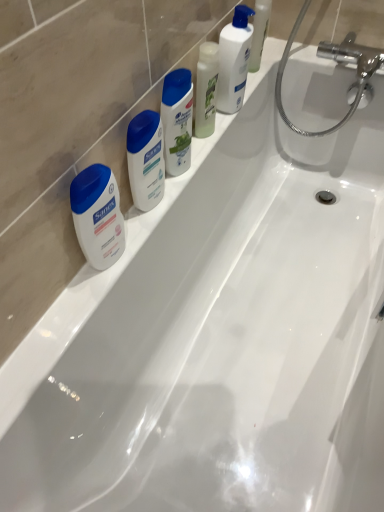
Question: Is white matte sanex soap at left, the 1th toiletry when ordered from left to right, shorter than white glossy shampoo at center, the 1th cleaning product viewed from the left?

Choices:
 (A) no
 (B) yes

Answer: (B)

Question: Is white matte sanex soap at left, placed as the second toiletry when sorted from right to left, at the right side of white glossy shampoo at center, which is the 3th cleaning product in right-to-left order?

Choices:
 (A) yes
 (B) no

Answer: (B)

Question: From the image's perspective, is white matte sanex soap at left, the 1th toiletry when ordered from left to right, above white glossy shampoo at center, the 1th cleaning product viewed from the left?

Choices:
 (A) no
 (B) yes

Answer: (A)

Question: Is white matte sanex soap at left, placed as the second toiletry when sorted from right to left, aimed at white glossy shampoo at center, the 1th cleaning product viewed from the left?

Choices:
 (A) no
 (B) yes

Answer: (A)

Question: Does white matte sanex soap at left, the 1th toiletry when ordered from left to right, have a greater height compared to white glossy shampoo at center, the 1th cleaning product viewed from the left?

Choices:
 (A) no
 (B) yes

Answer: (A)

Question: Would you say white matte sanex soap at left, placed as the second toiletry when sorted from right to left, is a long distance from white glossy shampoo at center, which is the 3th cleaning product in right-to-left order?

Choices:
 (A) no
 (B) yes

Answer: (A)

Question: Does white glossy lotion at upper center, positioned as the third cleaning product in left-to-right order, have a lesser height compared to matte white lotion at center, the 1th toiletry positioned from the right?

Choices:
 (A) no
 (B) yes

Answer: (A)

Question: Is matte white lotion at center, placed as the second toiletry when sorted from left to right, a part of white glossy lotion at upper center, which appears as the first cleaning product when viewed from the right?

Choices:
 (A) yes
 (B) no

Answer: (B)

Question: From the image's perspective, is white glossy lotion at upper center, which appears as the first cleaning product when viewed from the right, under matte white lotion at center, placed as the second toiletry when sorted from left to right?

Choices:
 (A) yes
 (B) no

Answer: (B)

Question: Is the position of white glossy lotion at upper center, which appears as the first cleaning product when viewed from the right, more distant than that of matte white lotion at center, placed as the second toiletry when sorted from left to right?

Choices:
 (A) yes
 (B) no

Answer: (A)

Question: From a real-world perspective, does white glossy lotion at upper center, which appears as the first cleaning product when viewed from the right, stand above matte white lotion at center, the 1th toiletry positioned from the right?

Choices:
 (A) no
 (B) yes

Answer: (B)

Question: Would you consider white glossy lotion at upper center, which appears as the first cleaning product when viewed from the right, to be distant from matte white lotion at center, the 1th toiletry positioned from the right?

Choices:
 (A) no
 (B) yes

Answer: (A)

Question: From the image's perspective, is white glossy lotion at upper center, positioned as the third cleaning product in left-to-right order, below white glossy shampoo at center, which is the 3th cleaning product in right-to-left order?

Choices:
 (A) no
 (B) yes

Answer: (A)